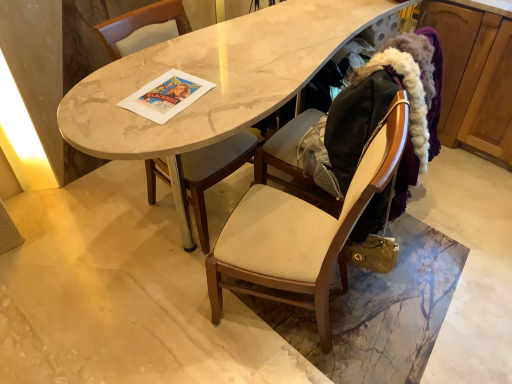
You are a GUI agent. You are given a task and a screenshot of the screen. Output one action in this format:
    pyautogui.click(x=<x>, y=<y>)
    Task: Click on the vacant space to the left of matte gray cushioned chair at center, which appears as the 2th chair when viewed from the right
    
    Given the screenshot: What is the action you would take?
    [x=99, y=215]